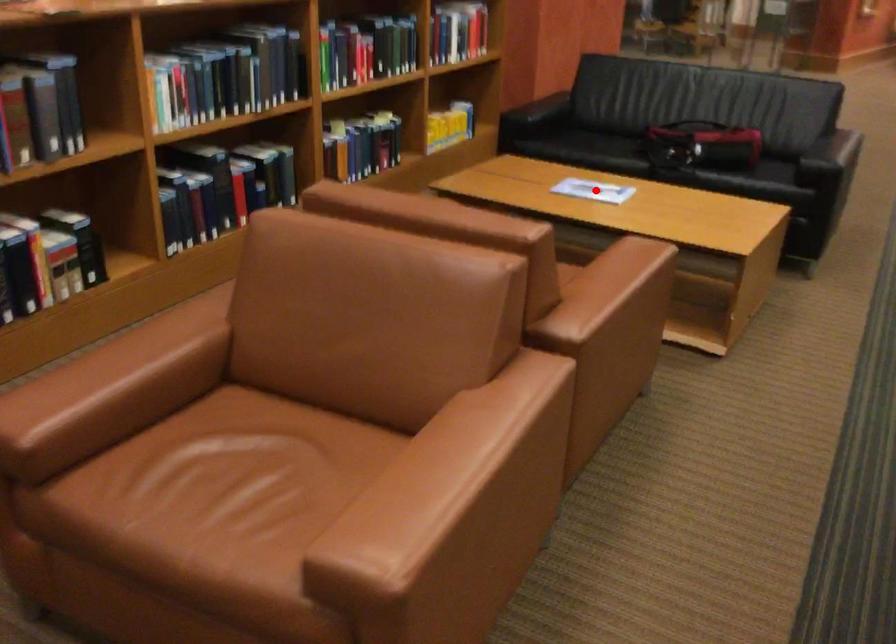
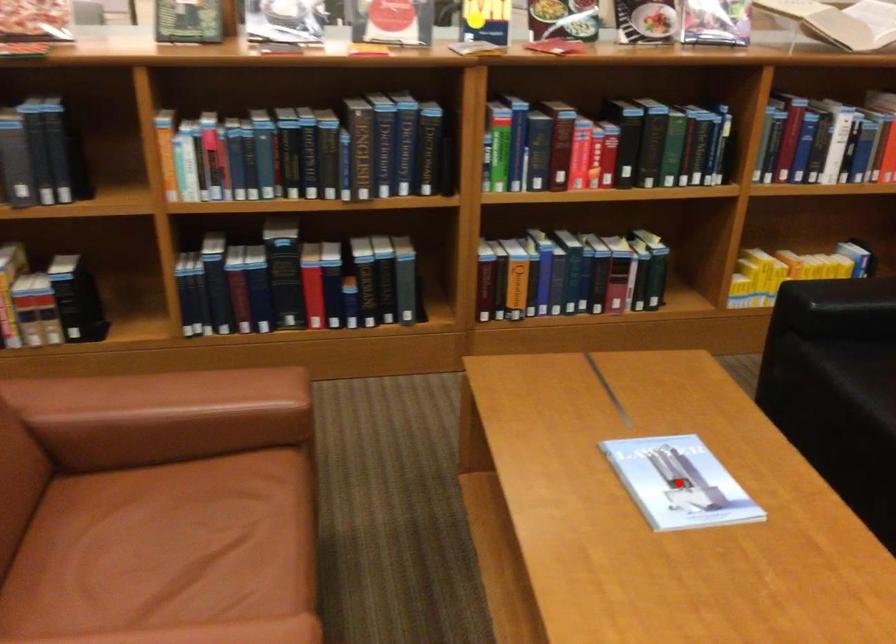
I am providing you with two images of the same scene from different viewpoints. A red point is marked on the first image and another point is marked on the second image. Does the point marked in image1 correspond to the same location as the one in image2?

Yes